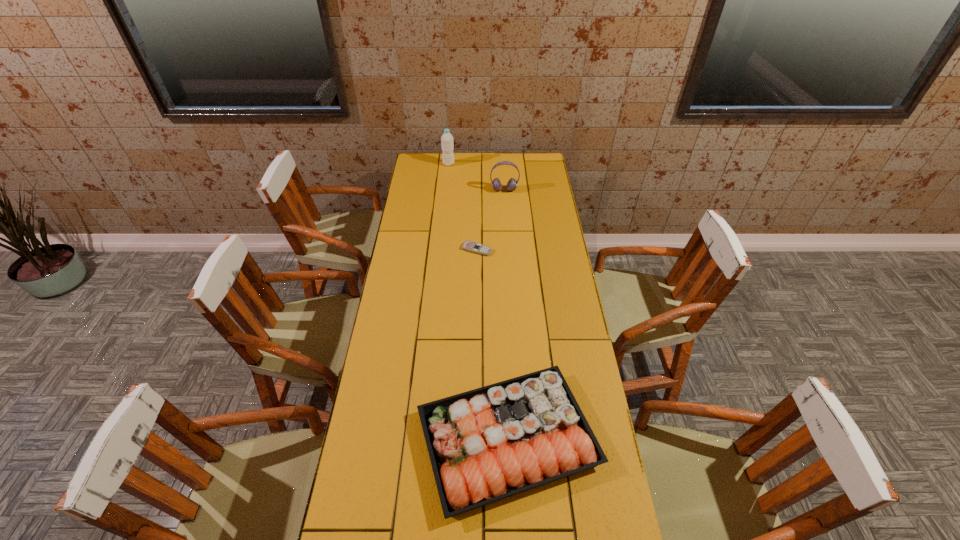
Locate an element on the screen. The image size is (960, 540). free spot located on the left of the third tallest object is located at coordinates (386, 439).

This screenshot has height=540, width=960. Find the location of `vacant region located on the left of the shortest object`. vacant region located on the left of the shortest object is located at coordinates (396, 249).

At what (x,y) coordinates should I click in order to perform the action: click on object that is at the far edge. Please return your answer as a coordinate pair (x, y). Looking at the image, I should click on (447, 143).

Identify the location of object located at the right edge. (487, 444).

I want to click on free space at the left edge, so point(369,450).

This screenshot has width=960, height=540. I want to click on free space at the right edge, so click(x=528, y=222).

Image resolution: width=960 pixels, height=540 pixels. In the image, there is a desktop. Identify the location of vacant region at the far left corner. (424, 154).

Identify the location of vacant area at the far right corner. The width and height of the screenshot is (960, 540). (530, 158).

Identify the location of empty space that is in between the water bottle and the shortest object. The image size is (960, 540). (463, 207).

This screenshot has height=540, width=960. I want to click on vacant region between the water bottle and the headset, so click(x=476, y=177).